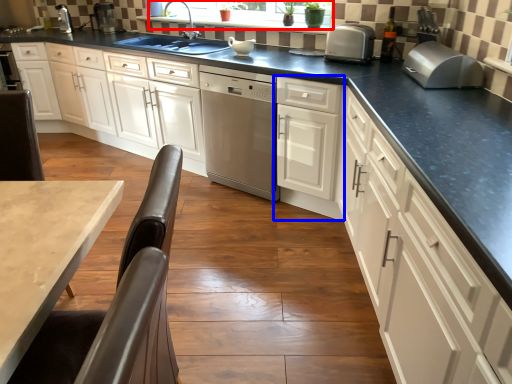
Question: Among these objects, which one is nearest to the camera, window screen (highlighted by a red box) or cabinetry (highlighted by a blue box)?

Choices:
 (A) window screen
 (B) cabinetry

Answer: (B)